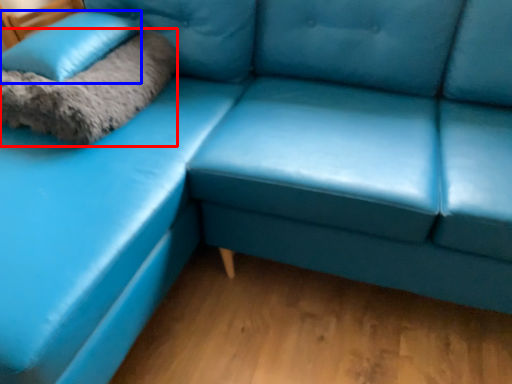
Question: Which of the following is the farthest to the observer, blanket (highlighted by a red box) or pillow (highlighted by a blue box)?

Choices:
 (A) blanket
 (B) pillow

Answer: (B)